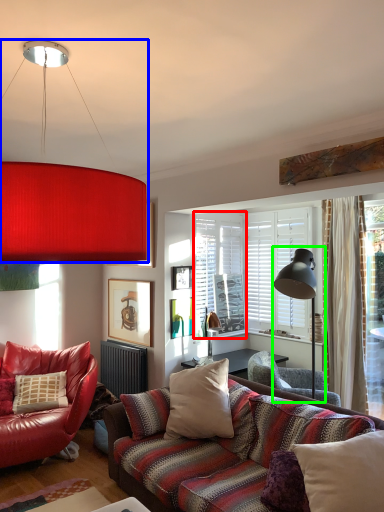
Question: Estimate the real-world distances between objects in this image. Which object is closer to window screen (highlighted by a red box), lamp (highlighted by a blue box) or table lamp (highlighted by a green box)?

Choices:
 (A) lamp
 (B) table lamp

Answer: (B)